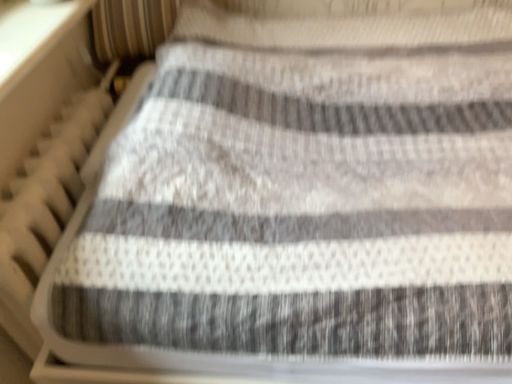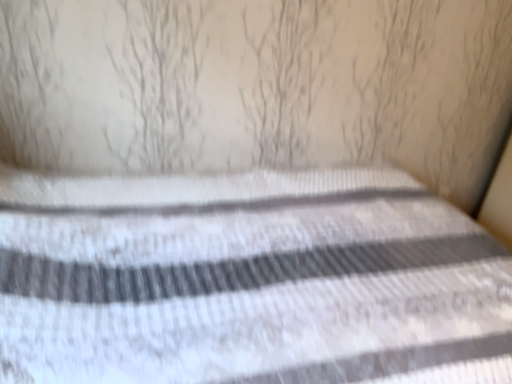
Question: Which way did the camera rotate in the video?

Choices:
 (A) rotated right
 (B) rotated left

Answer: (A)